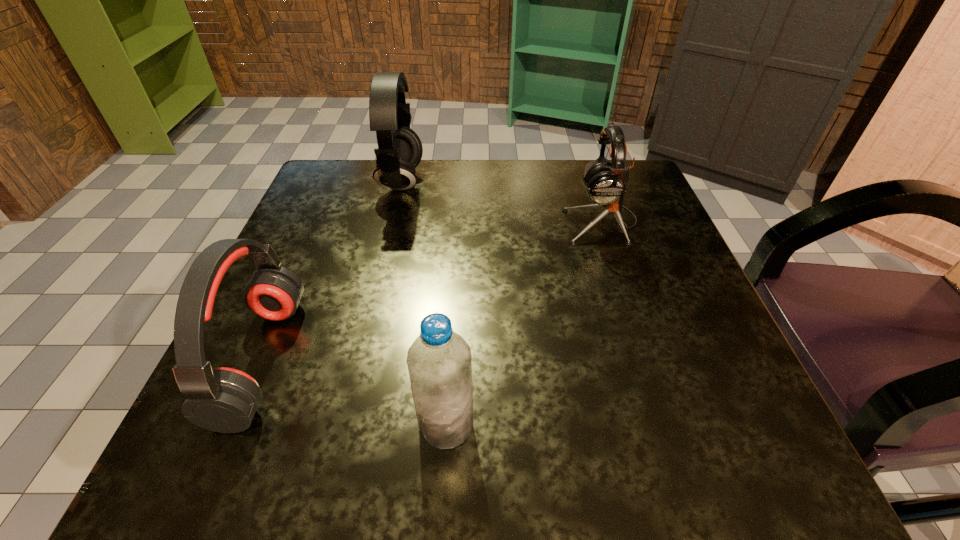
This screenshot has height=540, width=960. I want to click on earphone that is at the near edge, so point(224,400).

At what (x,y) coordinates should I click in order to perform the action: click on object that is at the right edge. Please return your answer as a coordinate pair (x, y). The height and width of the screenshot is (540, 960). Looking at the image, I should click on (606, 183).

The image size is (960, 540). What are the coordinates of `object present at the far left corner` in the screenshot? It's located at (399, 152).

Identify the location of object positioned at the near left corner. The image size is (960, 540). (224, 400).

The height and width of the screenshot is (540, 960). Identify the location of object present at the far right corner. (606, 183).

In the image, there is a desktop. Where is `blank space at the far edge`? The height and width of the screenshot is (540, 960). blank space at the far edge is located at coordinates coord(567,220).

In the image, there is a desktop. At what (x,y) coordinates should I click in order to perform the action: click on vacant space at the near edge. Please return your answer as a coordinate pair (x, y). This screenshot has height=540, width=960. Looking at the image, I should click on (585, 474).

In the image, there is a desktop. Identify the location of free space at the left edge. The height and width of the screenshot is (540, 960). (316, 232).

Locate an element on the screen. free space at the right edge of the desktop is located at coordinates (726, 395).

In the image, there is a desktop. At what (x,y) coordinates should I click in order to perform the action: click on vacant space at the far left corner. Please return your answer as a coordinate pair (x, y). Looking at the image, I should click on (313, 220).